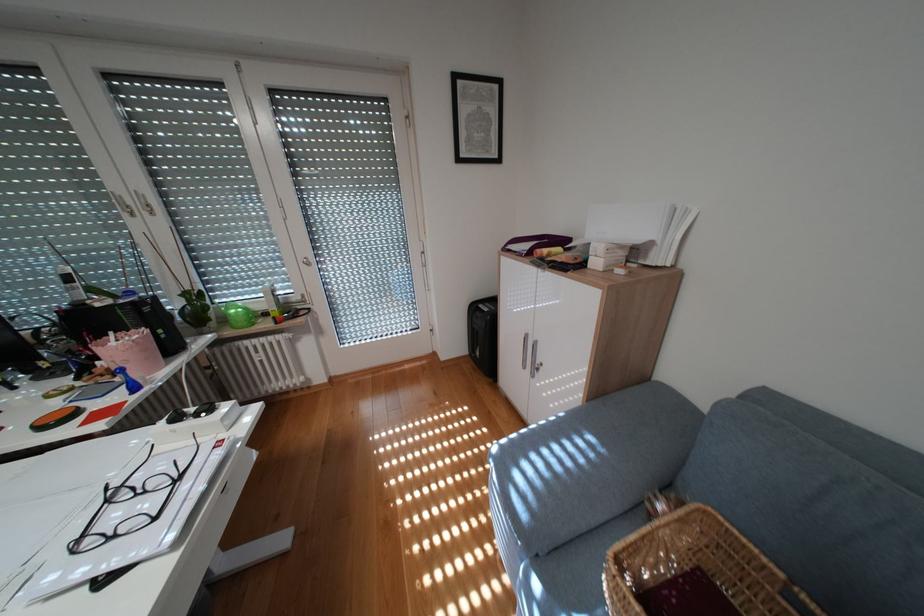
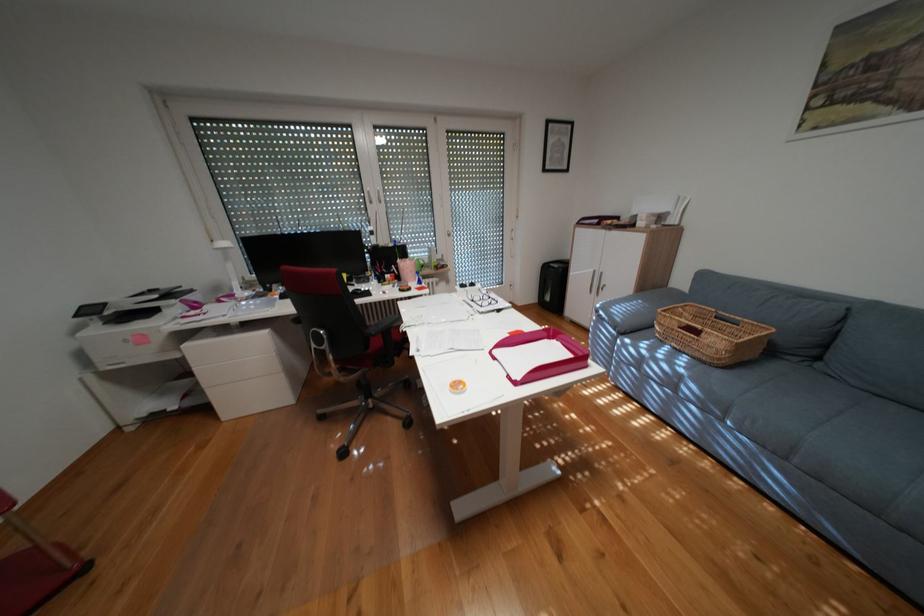
Which direction would the cameraman need to move to produce the second image?

The movement direction of the cameraman is left, backward.